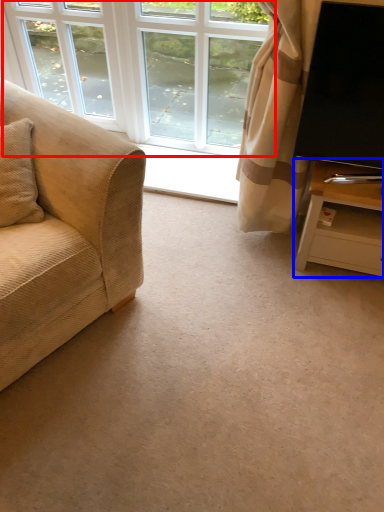
Question: Among these objects, which one is farthest to the camera, window (highlighted by a red box) or table (highlighted by a blue box)?

Choices:
 (A) window
 (B) table

Answer: (A)